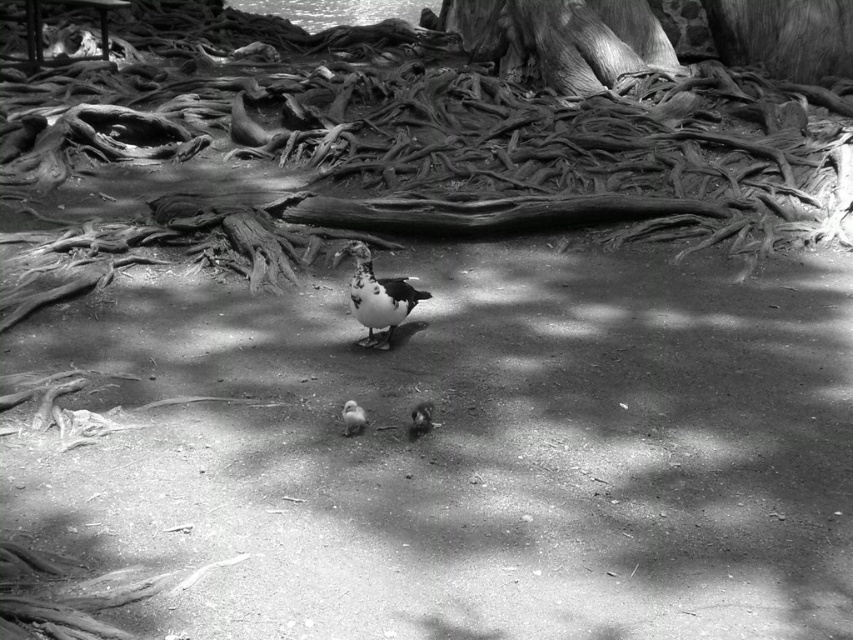
You are a photographer trying to capture a clear image of the white downy duckling at center and the white fluffy pigeon at center. Which one is more likely to be in focus if your camera is focused on the ground level?

The white downy duckling at center is much taller as white fluffy pigeon at center, so the white downy duckling at center would be more likely to be in focus when the camera is focused on the ground level since it is taller and closer to the focus plane.

Looking at this image, you are a birdwatcher observing the scene. You notice a white downy duckling at center and a dark gray matte pigeon at center. Which bird is closer to you?

The white downy duckling at center is closer to you because the dark gray matte pigeon at center is behind it.